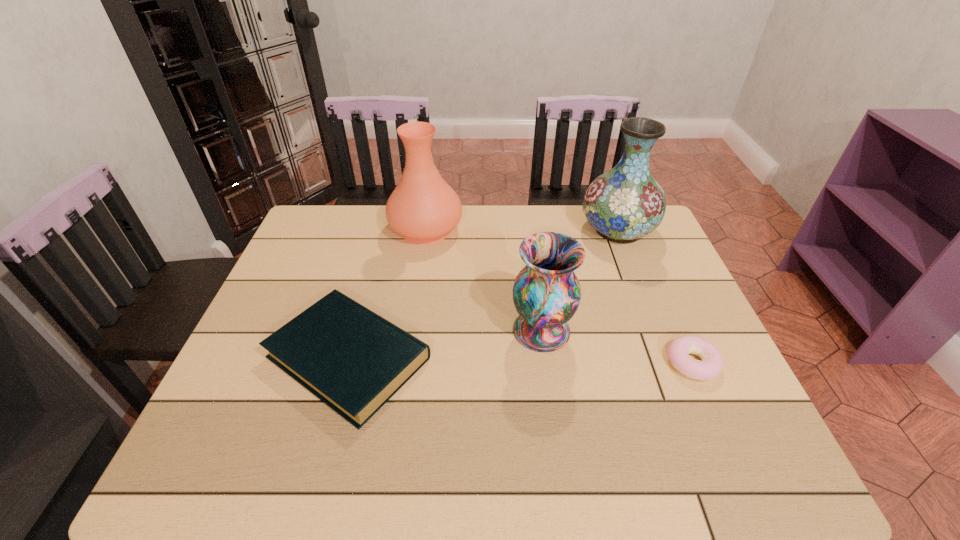
You are a GUI agent. You are given a task and a screenshot of the screen. Output one action in this format:
    pyautogui.click(x=<x>, y=<y>)
    Task: Click on the unoccupied position between the fourth tallest object and the rightmost vase
    
    Given the screenshot: What is the action you would take?
    tap(483, 294)

Where is `vacant point located between the book and the doughnut`? The width and height of the screenshot is (960, 540). vacant point located between the book and the doughnut is located at coordinates (520, 360).

Find the location of a particular element. vacant area between the third object from right to left and the rightmost vase is located at coordinates (580, 280).

Find the location of a particular element. The width and height of the screenshot is (960, 540). vacant area between the book and the second vase from left to right is located at coordinates 444,344.

Find the location of `vacant space in between the third shortest object and the leftmost vase`. vacant space in between the third shortest object and the leftmost vase is located at coordinates (484, 280).

I want to click on vacant space that's between the leftmost vase and the book, so click(387, 293).

At what (x,y) coordinates should I click in order to perform the action: click on empty space between the leftmost vase and the second vase from right to left. Please return your answer as a coordinate pair (x, y). Looking at the image, I should click on (484, 280).

Where is `vacant area that lies between the leftmost vase and the rightmost vase`? The image size is (960, 540). vacant area that lies between the leftmost vase and the rightmost vase is located at coordinates (521, 230).

You are a GUI agent. You are given a task and a screenshot of the screen. Output one action in this format:
    pyautogui.click(x=<x>, y=<y>)
    Task: Click on the empty space that is in between the shortest object and the rightmost vase
    This screenshot has width=960, height=540.
    Given the screenshot: What is the action you would take?
    pyautogui.click(x=655, y=296)

Identify which object is located as the second nearest to the third shortest object. Please provide its 2D coordinates. Your answer should be formatted as a tuple, i.e. [(x, y)], where the tuple contains the x and y coordinates of a point satisfying the conditions above.

[(710, 367)]